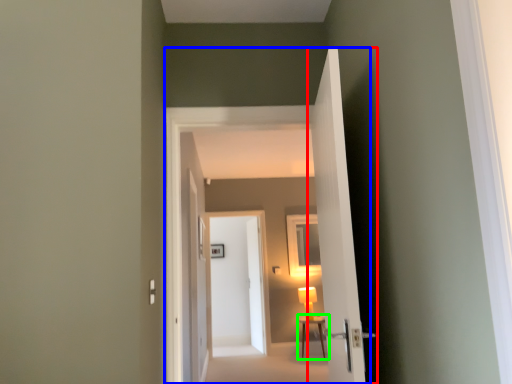
Question: Based on their relative distances, which object is nearer to door (highlighted by a red box)? Choose from corridor (highlighted by a blue box) and table (highlighted by a green box).

Choices:
 (A) corridor
 (B) table

Answer: (A)